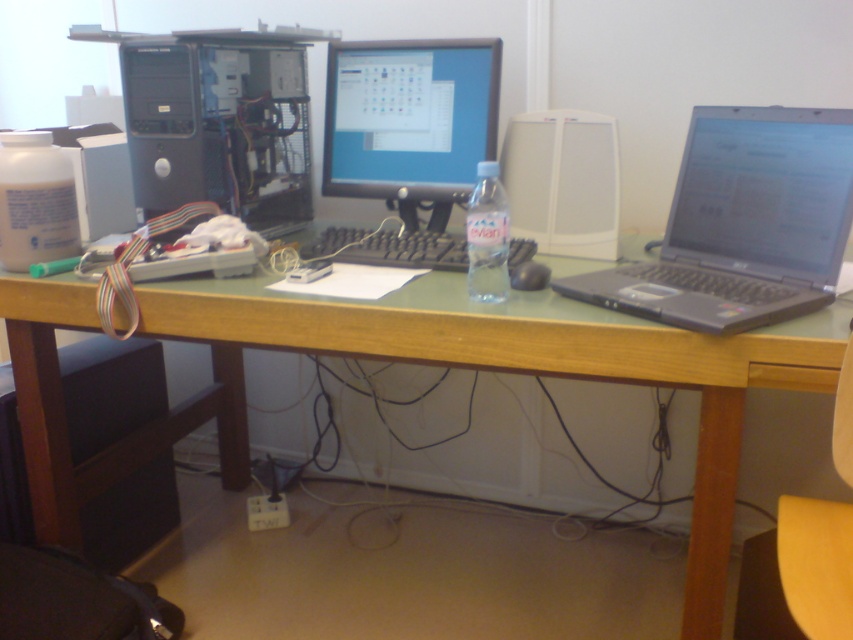
Based on the photo, you are organizing your workspace and want to move the black plastic laptop at right closer to the green wood computer desk at center. Which direction should you move the laptop to align it with the desk?

You should move the black plastic laptop at right to the left to align it with the green wood computer desk at center since the desk is to the left of the laptop.

You are organizing your desk and need to place a new item between the matte plastic monitor at center and the open desktop computer tower on the left. Based on their positions, where should you place the new item?

The new item should be placed between the matte plastic monitor at center and the open desktop computer tower on the left, as the matte plastic monitor at center is located at point [409,122], which is to the right of the open desktop computer tower on the left.

Looking at this image, you are setting up a new ergonomic workstation and need to place the black matte keyboard at center and the black plastic mouse at center on the desk. Since space is limited, which object should you place first to ensure both fit comfortably?

The black matte keyboard at center is larger than the black plastic mouse at center, so you should place the black matte keyboard at center first to ensure there is enough space for both items.